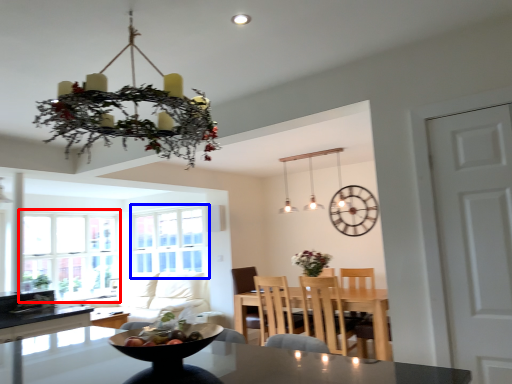
Question: Which point is further to the camera, window (highlighted by a red box) or window screen (highlighted by a blue box)?

Choices:
 (A) window
 (B) window screen

Answer: (B)